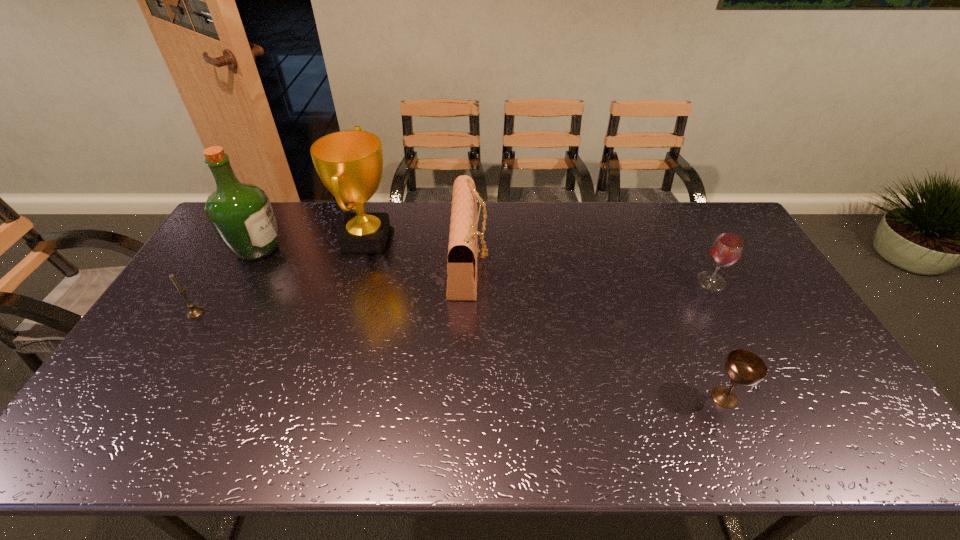
The image size is (960, 540). I want to click on vacant space located 0.300m on the front-facing side of the handbag, so click(x=578, y=262).

The width and height of the screenshot is (960, 540). I want to click on free space located 0.250m on the front of the rightmost object, so click(x=752, y=357).

Where is `vacant space located 0.380m on the back of the candle`? This screenshot has height=540, width=960. vacant space located 0.380m on the back of the candle is located at coordinates (247, 228).

At what (x,y) coordinates should I click in order to perform the action: click on free space located 0.300m on the left of the chalice. Please return your answer as a coordinate pair (x, y). The image size is (960, 540). Looking at the image, I should click on (588, 397).

In order to click on liquor present at the far edge in this screenshot , I will do `click(241, 214)`.

Find the location of a particular element. award situated at the far edge is located at coordinates (350, 163).

This screenshot has height=540, width=960. Find the location of `handbag present at the far edge`. handbag present at the far edge is located at coordinates (462, 249).

I want to click on liquor that is at the left edge, so click(x=241, y=214).

You are a GUI agent. You are given a task and a screenshot of the screen. Output one action in this format:
    pyautogui.click(x=<x>, y=<y>)
    Task: Click on the candle that is at the left edge
    This screenshot has height=540, width=960.
    Given the screenshot: What is the action you would take?
    pyautogui.click(x=194, y=312)

Locate an element on the screen. This screenshot has width=960, height=540. object present at the right edge is located at coordinates (726, 250).